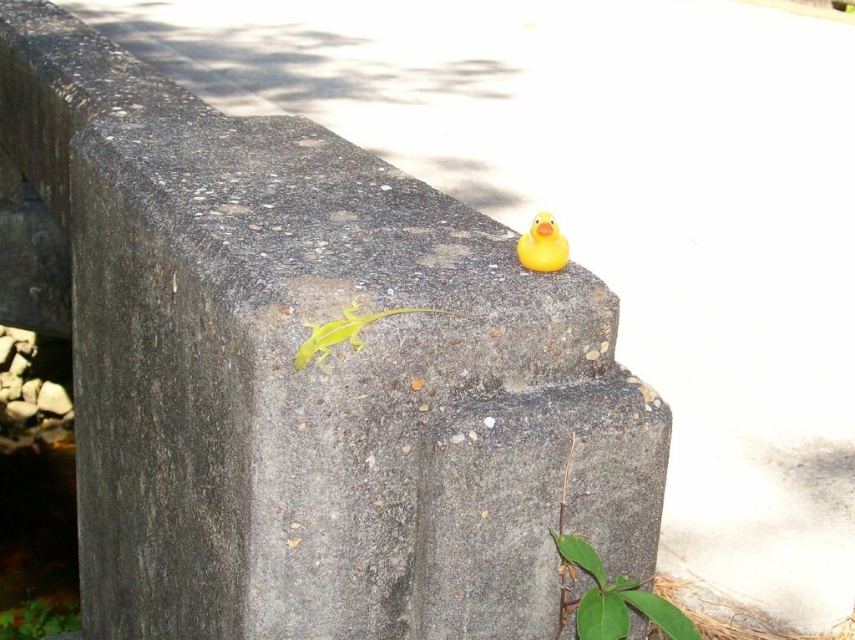
Between smooth green lizard at center and rubber duck at upper right, which one is positioned lower?

smooth green lizard at center is lower down.

Is smooth green lizard at center in front of rubber duck at upper right?

Yes, it is in front of rubber duck at upper right.

Where is `smooth green lizard at center`? The width and height of the screenshot is (855, 640). smooth green lizard at center is located at coordinates (346, 332).